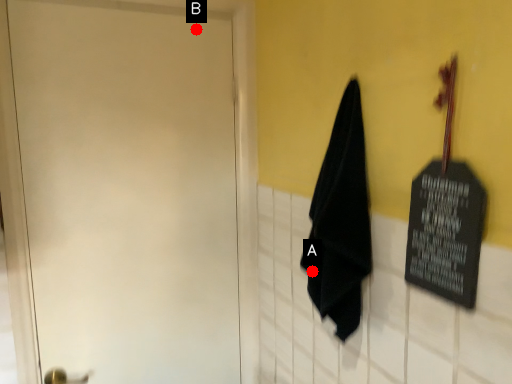
Question: Two points are circled on the image, labeled by A and B beside each circle. Which point is closer to the camera?

Choices:
 (A) A is closer
 (B) B is closer

Answer: (A)